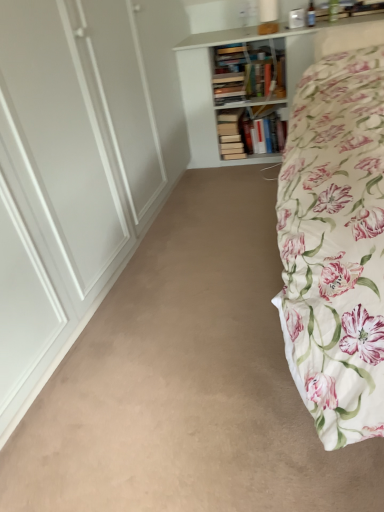
The width and height of the screenshot is (384, 512). What do you see at coordinates (212, 85) in the screenshot?
I see `white wooden bookcase at upper center` at bounding box center [212, 85].

This screenshot has height=512, width=384. Describe the element at coordinates (187, 380) in the screenshot. I see `beige carpet at center` at that location.

This screenshot has width=384, height=512. In order to click on white wooden bookcase at upper center in this screenshot , I will do `click(212, 85)`.

This screenshot has width=384, height=512. I want to click on bed on the right of the beige carpet at center, so click(x=335, y=245).

Does beige carpet at center contain floral cotton bed at right?

No, floral cotton bed at right is not surrounded by beige carpet at center.

Between beige carpet at center and floral cotton bed at right, which one has smaller size?

Smaller between the two is beige carpet at center.

From the picture: Is beige carpet at center turned away from floral cotton bed at right?

No, beige carpet at center is not facing away from floral cotton bed at right.

Can you confirm if floral cotton bed at right is taller than white wooden bookcase at upper center?

Incorrect, the height of floral cotton bed at right is not larger of that of white wooden bookcase at upper center.

Is floral cotton bed at right oriented away from white wooden bookcase at upper center?

Yes, floral cotton bed at right is facing away from white wooden bookcase at upper center.

From a real-world perspective, relative to white wooden bookcase at upper center, is floral cotton bed at right vertically above or below?

In terms of real-world spatial position, floral cotton bed at right is below white wooden bookcase at upper center.

In the image, is floral cotton bed at right positioned in front of or behind white wooden bookcase at upper center?

floral cotton bed at right is in front of white wooden bookcase at upper center.

Which point is more forward, (191, 67) or (294, 167)?

Point (294, 167)

From the image's perspective, is white wooden bookcase at upper center on top of floral cotton bed at right?

Yes, from the image's perspective, white wooden bookcase at upper center is above floral cotton bed at right.

From a real-world perspective, is white wooden bookcase at upper center physically above floral cotton bed at right?

Indeed, from a real-world perspective, white wooden bookcase at upper center stands above floral cotton bed at right.

Could you tell me if beige carpet at center is facing white wooden bookcase at upper center?

No, beige carpet at center does not turn towards white wooden bookcase at upper center.

Does beige carpet at center have a lesser height compared to white wooden bookcase at upper center?

Indeed, beige carpet at center has a lesser height compared to white wooden bookcase at upper center.

Would you say white wooden bookcase at upper center is part of beige carpet at center's contents?

No, white wooden bookcase at upper center is not a part of beige carpet at center.

Can we say floral cotton bed at right lies outside beige carpet at center?

Indeed, floral cotton bed at right is completely outside beige carpet at center.

Considering the sizes of objects floral cotton bed at right and beige carpet at center in the image provided, who is taller, floral cotton bed at right or beige carpet at center?

floral cotton bed at right.

Considering the points (364, 329) and (252, 321), which point is in front, point (364, 329) or point (252, 321)?

The point (364, 329) is in front.

Where is `plain that appears on the left of floral cotton bed at right`? The image size is (384, 512). plain that appears on the left of floral cotton bed at right is located at coordinates (187, 380).

Who is more distant, white wooden bookcase at upper center or beige carpet at center?

Positioned behind is white wooden bookcase at upper center.

Is white wooden bookcase at upper center spatially inside beige carpet at center, or outside of it?

white wooden bookcase at upper center cannot be found inside beige carpet at center.

How far apart are white wooden bookcase at upper center and beige carpet at center?

The distance of white wooden bookcase at upper center from beige carpet at center is 4.27 feet.

Is white wooden bookcase at upper center in contact with beige carpet at center?

No, white wooden bookcase at upper center is not touching beige carpet at center.

I want to click on plain behind the floral cotton bed at right, so click(x=187, y=380).

Image resolution: width=384 pixels, height=512 pixels. I want to click on bed that appears on the right of white wooden bookcase at upper center, so click(335, 245).

Based on their spatial positions, is white wooden bookcase at upper center or beige carpet at center further from floral cotton bed at right?

white wooden bookcase at upper center is further to floral cotton bed at right.

Which object lies nearer to the anchor point white wooden bookcase at upper center, beige carpet at center or floral cotton bed at right?

floral cotton bed at right.

Looking at the image, which one is located closer to floral cotton bed at right, beige carpet at center or white wooden bookcase at upper center?

Based on the image, beige carpet at center appears to be nearer to floral cotton bed at right.

Which object lies nearer to the anchor point beige carpet at center, floral cotton bed at right or white wooden bookcase at upper center?

The object closer to beige carpet at center is floral cotton bed at right.

Looking at the image, which one is located further to beige carpet at center, white wooden bookcase at upper center or floral cotton bed at right?

The object further to beige carpet at center is white wooden bookcase at upper center.

Considering their positions, is floral cotton bed at right positioned further to white wooden bookcase at upper center than beige carpet at center?

beige carpet at center is positioned further to the anchor white wooden bookcase at upper center.

The height and width of the screenshot is (512, 384). Find the location of `plain located between floral cotton bed at right and white wooden bookcase at upper center in the depth direction`. plain located between floral cotton bed at right and white wooden bookcase at upper center in the depth direction is located at coordinates (187, 380).